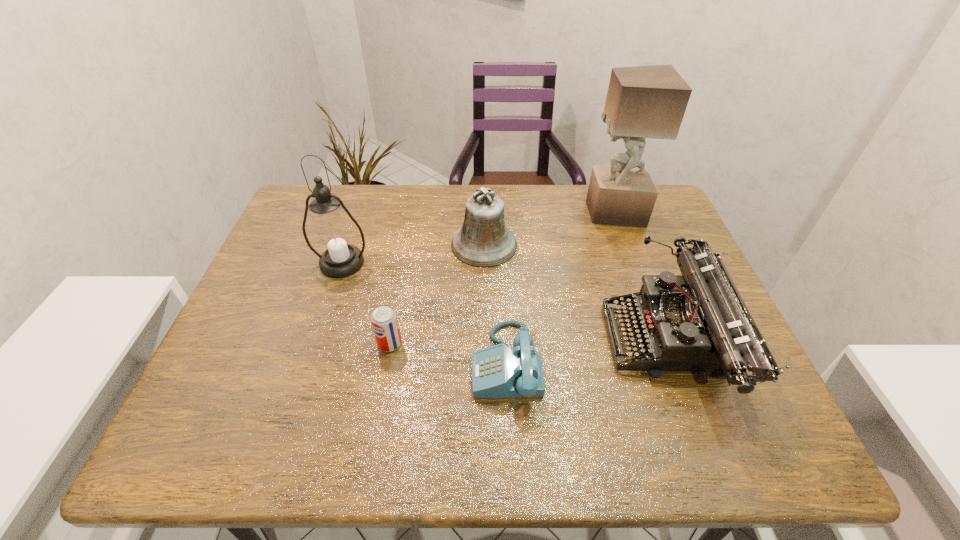
The image size is (960, 540). Find the location of `vacant region located 0.340m on the front-facing side of the tallest object`. vacant region located 0.340m on the front-facing side of the tallest object is located at coordinates (476, 212).

Image resolution: width=960 pixels, height=540 pixels. In order to click on free space located on the front of the second tallest object in this screenshot , I will do point(327,307).

At what (x,y) coordinates should I click in order to perform the action: click on vacant region located 0.180m on the front of the bell. Please return your answer as a coordinate pair (x, y). Looking at the image, I should click on (485, 320).

Locate an element on the screen. This screenshot has width=960, height=540. vacant region located 0.280m on the keyboard of the typewriter is located at coordinates (486, 342).

The width and height of the screenshot is (960, 540). I want to click on free space located 0.360m on the keyboard of the typewriter, so click(450, 342).

The height and width of the screenshot is (540, 960). Find the location of `vacant space located 0.050m on the keyboard of the typewriter`. vacant space located 0.050m on the keyboard of the typewriter is located at coordinates (587, 342).

The image size is (960, 540). I want to click on free space located 0.060m on the back of the fifth tallest object, so click(395, 314).

The height and width of the screenshot is (540, 960). Find the location of `vacant region located 0.290m on the dial of the telephone`. vacant region located 0.290m on the dial of the telephone is located at coordinates (340, 363).

Where is `free space located 0.110m on the dial of the telephone`? The width and height of the screenshot is (960, 540). free space located 0.110m on the dial of the telephone is located at coordinates (422, 363).

What are the coordinates of `vacant point located 0.300m on the dial of the telephone` in the screenshot? It's located at click(336, 363).